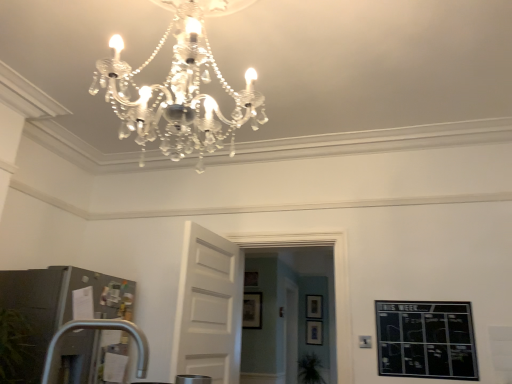
Question: Would you say matte black picture frame at center, placed as the fourth picture frame when sorted from top to bottom, is outside white wooden door at center?

Choices:
 (A) yes
 (B) no

Answer: (A)

Question: Is white wooden door at center located within matte black picture frame at center, the second picture frame from the right?

Choices:
 (A) no
 (B) yes

Answer: (A)

Question: Is matte black picture frame at center, the 2th picture frame in the back-to-front sequence, further to camera compared to white wooden door at center?

Choices:
 (A) no
 (B) yes

Answer: (B)

Question: Is matte black picture frame at center, the first picture frame when ordered from bottom to top, smaller than white wooden door at center?

Choices:
 (A) yes
 (B) no

Answer: (A)

Question: From the image's perspective, is matte black picture frame at center, which is counted as the 1th picture frame, starting from the front, located above or below wooden picture frame at center, which is the fourth picture frame from front to back?

Choices:
 (A) below
 (B) above

Answer: (B)

Question: In terms of width, does matte black picture frame at center, which is counted as the 1th picture frame, starting from the front, look wider or thinner when compared to wooden picture frame at center, placed as the first picture frame when sorted from right to left?

Choices:
 (A) thin
 (B) wide

Answer: (A)

Question: From a real-world perspective, is matte black picture frame at center, which ranks as the third picture frame in right-to-left order, physically located above or below wooden picture frame at center, the 4th picture frame viewed from the left?

Choices:
 (A) above
 (B) below

Answer: (B)

Question: Visually, is matte black picture frame at center, arranged as the 2th picture frame when viewed from the top, positioned to the left or to the right of wooden picture frame at center, which appears as the third picture frame when viewed from the top?

Choices:
 (A) left
 (B) right

Answer: (A)

Question: Is white wooden door at center to the left or to the right of wooden picture frame at center, which appears as the third picture frame when viewed from the top, in the image?

Choices:
 (A) right
 (B) left

Answer: (B)

Question: From their relative heights in the image, would you say white wooden door at center is taller or shorter than wooden picture frame at center, which appears as the third picture frame when viewed from the top?

Choices:
 (A) tall
 (B) short

Answer: (A)

Question: Is point (x=203, y=360) closer or farther from the camera than point (x=309, y=317)?

Choices:
 (A) farther
 (B) closer

Answer: (B)

Question: Is white wooden door at center spatially inside wooden picture frame at center, the 4th picture frame viewed from the left, or outside of it?

Choices:
 (A) outside
 (B) inside

Answer: (A)

Question: From the image's perspective, is matte black picture frame at center, placed as the fourth picture frame when sorted from top to bottom, above or below white wooden door at center?

Choices:
 (A) above
 (B) below

Answer: (B)

Question: Based on their positions, is matte black picture frame at center, the 3th picture frame when ordered from left to right, located to the left or right of white wooden door at center?

Choices:
 (A) left
 (B) right

Answer: (B)